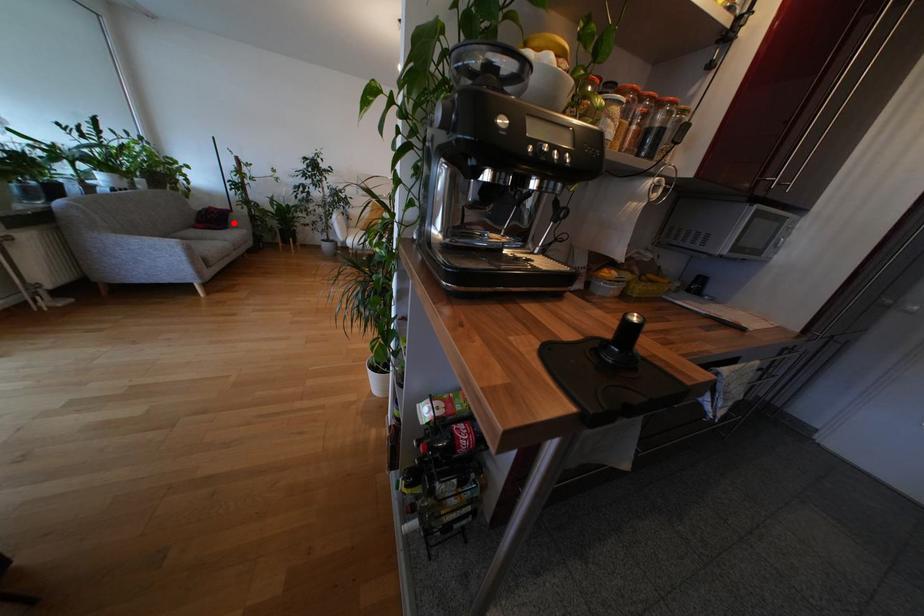
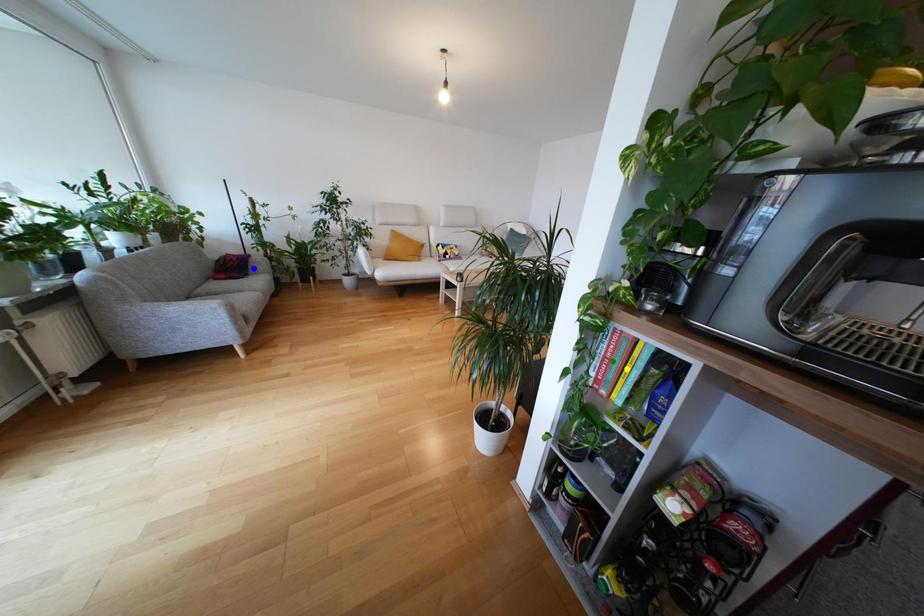
Question: I am providing you with two images of the same scene from different viewpoints. A red point is marked on the first image. You are given multiple points on the second image. Can you choose the point in image 2 that corresponds to the point in image 1?

Choices:
 (A) green point
 (B) yellow point
 (C) blue point

Answer: (C)